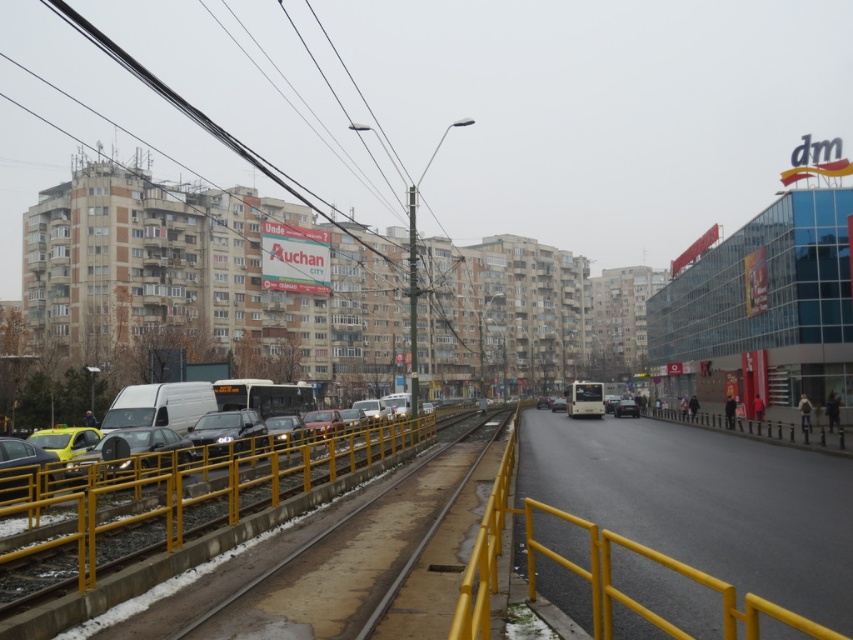
Question: Which object is positioned closest to the matte white van at center-left?

Choices:
 (A) yellow metal train track at center
 (B) yellow metal railing at lower right

Answer: (A)

Question: Does black wire at upper left have a greater width compared to matte white van at center-left?

Choices:
 (A) no
 (B) yes

Answer: (B)

Question: Which point is closer to the camera?

Choices:
 (A) matte white van at center-left
 (B) yellow metal railing at lower right
 (C) dark gray metallic car at center

Answer: (A)

Question: Is black wire at upper left closer to the viewer compared to matte white van at center-left?

Choices:
 (A) yes
 (B) no

Answer: (B)

Question: Does matte white van at center-left have a lesser width compared to dark gray metallic car at center?

Choices:
 (A) yes
 (B) no

Answer: (B)

Question: Which object is positioned closest to the black wire at upper left?

Choices:
 (A) dark gray metallic car at center
 (B) yellow metal train track at center
 (C) matte white van at center-left

Answer: (C)